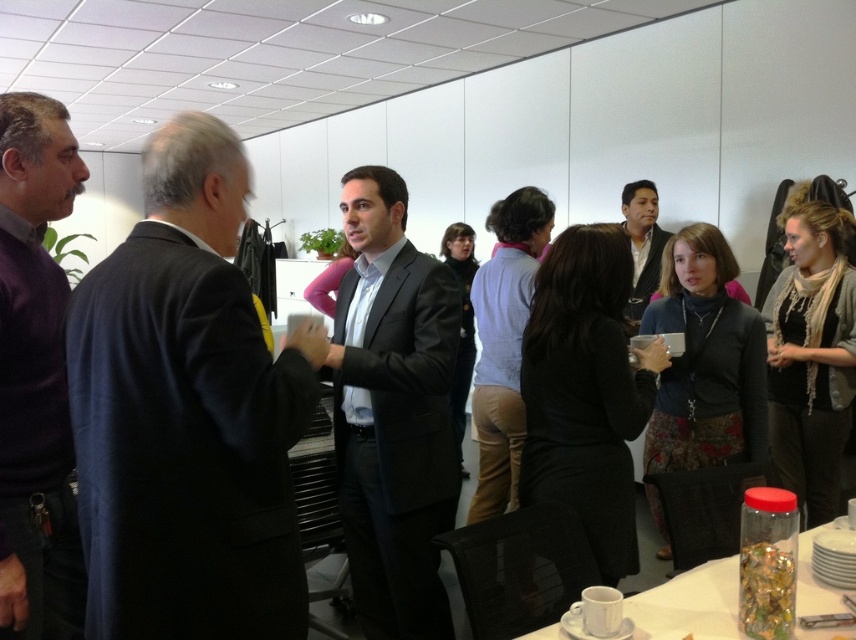
Which is more to the left, dark blue suit at left or dark brown leather jacket at center?

Positioned to the left is dark blue suit at left.

Does dark blue suit at left have a lesser height compared to dark brown leather jacket at center?

Incorrect, dark blue suit at left's height does not fall short of dark brown leather jacket at center's.

What are the coordinates of `dark blue suit at left` in the screenshot? It's located at (187, 413).

Can you confirm if dark blue suit at left is positioned below purple sweater at left?

No, dark blue suit at left is not below purple sweater at left.

Does dark blue suit at left lie behind purple sweater at left?

No, dark blue suit at left is closer to the viewer.

I want to click on dark blue suit at left, so click(x=187, y=413).

The image size is (856, 640). Identify the location of dark blue suit at left. (187, 413).

Who is positioned more to the left, dark blue suit at left or clear plastic jar at lower right?

dark blue suit at left

Describe the element at coordinates (187, 413) in the screenshot. I see `dark blue suit at left` at that location.

Is point (75, 452) positioned after point (684, 589)?

That is False.

Where is `dark blue suit at left`? The height and width of the screenshot is (640, 856). dark blue suit at left is located at coordinates (187, 413).